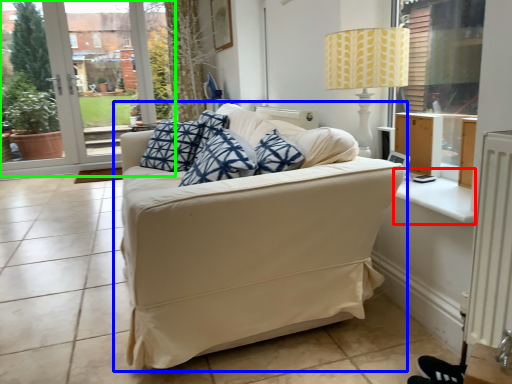
Question: Considering the real-world distances, which object is closest to window sill (highlighted by a red box)? studio couch (highlighted by a blue box) or window frame (highlighted by a green box).

Choices:
 (A) studio couch
 (B) window frame

Answer: (A)